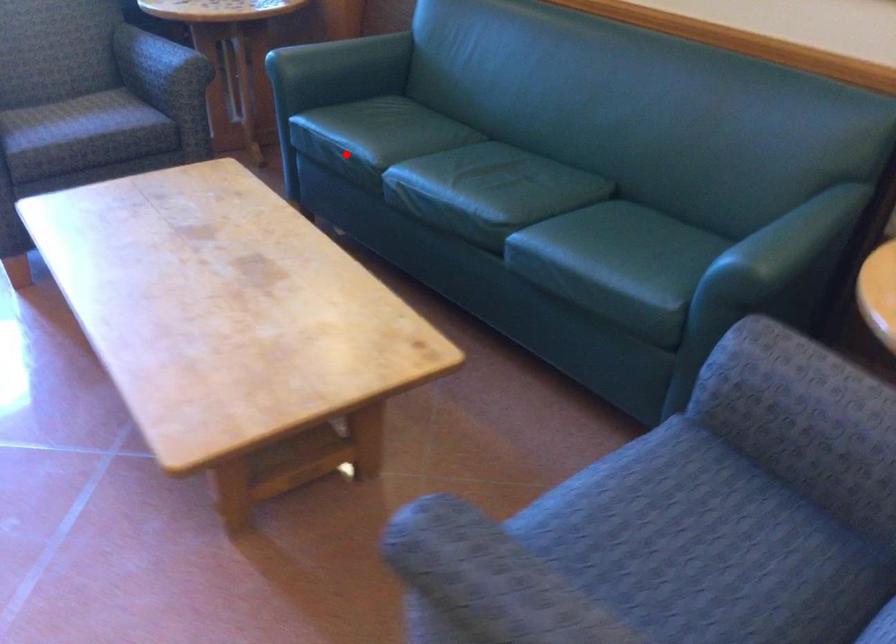
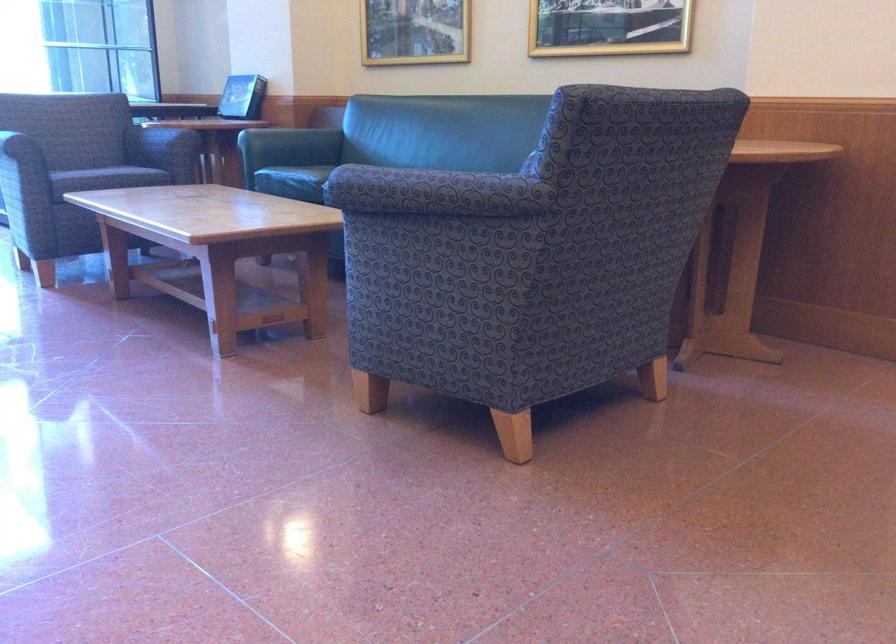
Question: I am providing you with two images of the same scene from different viewpoints. Given a red point in image1, look at the same physical point in image2. Is it:

Choices:
 (A) Closer to the viewpoint
 (B) Farther from the viewpoint

Answer: (B)